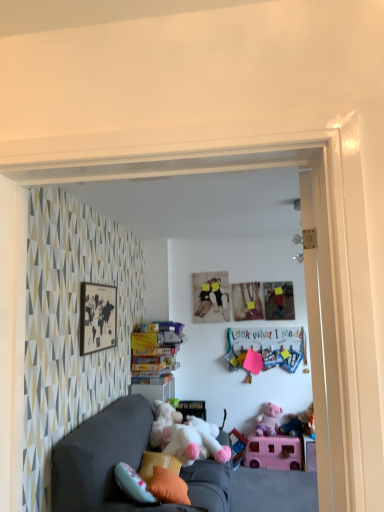
Question: Is matte pink paper at upper center positioned in front of orange fabric pillow at lower center, acting as the second pillow starting from the front?

Choices:
 (A) no
 (B) yes

Answer: (A)

Question: Does matte pink paper at upper center appear on the right side of orange fabric pillow at lower center, acting as the second pillow starting from the front?

Choices:
 (A) yes
 (B) no

Answer: (A)

Question: Can you confirm if matte pink paper at upper center is positioned to the left of orange fabric pillow at lower center, acting as the second pillow starting from the front?

Choices:
 (A) no
 (B) yes

Answer: (A)

Question: Is matte pink paper at upper center facing towards orange fabric pillow at lower center, the 1th pillow from the back?

Choices:
 (A) yes
 (B) no

Answer: (B)

Question: Can you confirm if matte pink paper at upper center is wider than orange fabric pillow at lower center, the 1th pillow from the back?

Choices:
 (A) yes
 (B) no

Answer: (B)

Question: Relative to velvet dark gray couch at center, is matte black map at upper left in front or behind?

Choices:
 (A) front
 (B) behind

Answer: (B)

Question: From a real-world perspective, is matte black map at upper left physically located above or below velvet dark gray couch at center?

Choices:
 (A) above
 (B) below

Answer: (A)

Question: From their relative heights in the image, would you say matte black map at upper left is taller or shorter than velvet dark gray couch at center?

Choices:
 (A) short
 (B) tall

Answer: (A)

Question: From the image's perspective, relative to velvet dark gray couch at center, is matte black map at upper left above or below?

Choices:
 (A) below
 (B) above

Answer: (B)

Question: Is orange fabric pillow at lower center, acting as the second pillow starting from the front, to the left or to the right of velvet dark gray couch at center in the image?

Choices:
 (A) right
 (B) left

Answer: (B)

Question: From their relative heights in the image, would you say orange fabric pillow at lower center, the 1th pillow from the back, is taller or shorter than velvet dark gray couch at center?

Choices:
 (A) tall
 (B) short

Answer: (B)

Question: Is point (160, 453) closer or farther from the camera than point (198, 463)?

Choices:
 (A) farther
 (B) closer

Answer: (A)

Question: Relative to velvet dark gray couch at center, is orange fabric pillow at lower center, acting as the second pillow starting from the front, in front or behind?

Choices:
 (A) behind
 (B) front

Answer: (A)

Question: In terms of size, does matte gray couch at lower center appear bigger or smaller than matte pink paper at upper center?

Choices:
 (A) big
 (B) small

Answer: (A)

Question: From the image's perspective, is matte gray couch at lower center positioned above or below matte pink paper at upper center?

Choices:
 (A) below
 (B) above

Answer: (A)